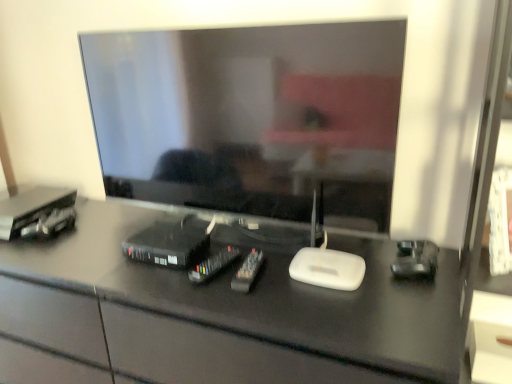
Find the location of a particular element. This screenshot has height=384, width=512. vacant space to the right of black plastic remote control at center, the 3th equipment in the left-to-right sequence is located at coordinates (284, 274).